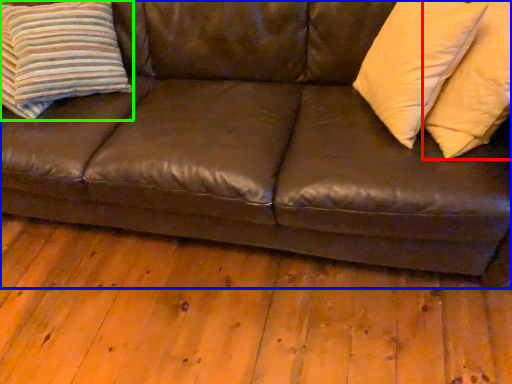
Question: Estimate the real-world distances between objects in this image. Which object is farther from pillow (highlighted by a red box), studio couch (highlighted by a blue box) or pillow (highlighted by a green box)?

Choices:
 (A) studio couch
 (B) pillow

Answer: (B)